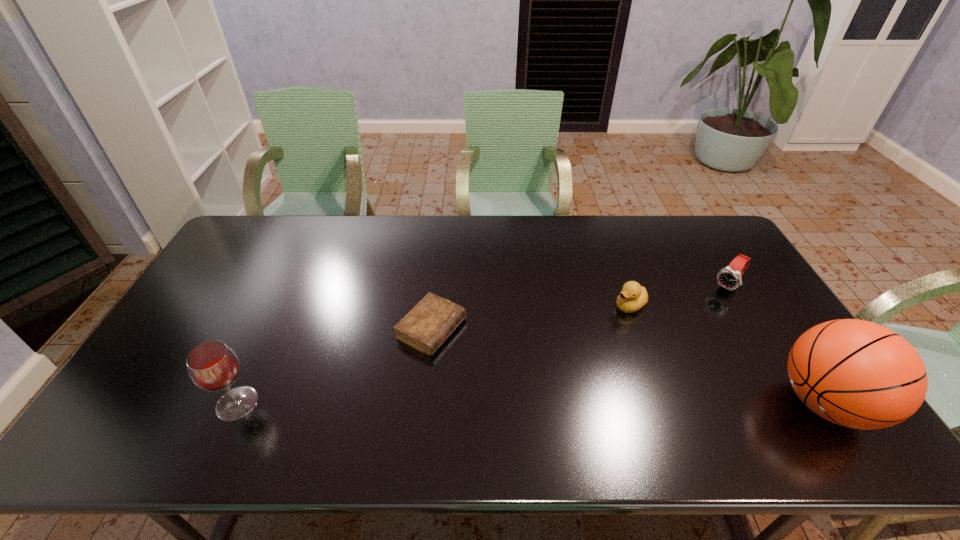
The height and width of the screenshot is (540, 960). I want to click on basketball located at the right edge, so click(x=858, y=374).

The width and height of the screenshot is (960, 540). In order to click on watch positioned at the right edge in this screenshot , I will do 729,277.

Locate an element on the screen. This screenshot has width=960, height=540. object that is at the near right corner is located at coordinates (858, 374).

In the image, there is a desktop. Where is `free region at the far edge`? This screenshot has width=960, height=540. free region at the far edge is located at coordinates (533, 224).

Where is `vacant region at the near edge of the desktop`? vacant region at the near edge of the desktop is located at coordinates (631, 383).

Find the location of `free space at the left edge of the desktop`. free space at the left edge of the desktop is located at coordinates (242, 257).

Locate an element on the screen. This screenshot has width=960, height=540. vacant region at the right edge of the desktop is located at coordinates (735, 257).

Find the location of a particular element. This screenshot has width=960, height=540. vacant space at the far left corner of the desktop is located at coordinates (242, 239).

This screenshot has width=960, height=540. In order to click on vacant area at the far right corner of the desktop in this screenshot , I will do `click(685, 238)`.

This screenshot has width=960, height=540. I want to click on free space between the third object from right to left and the fourth object from right to left, so click(x=531, y=317).